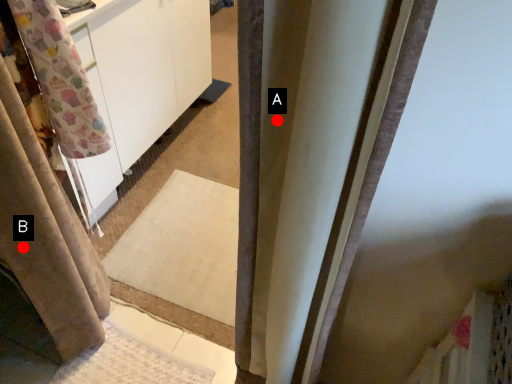
Question: Two points are circled on the image, labeled by A and B beside each circle. Which point appears farthest from the camera in this image?

Choices:
 (A) A is further
 (B) B is further

Answer: (B)